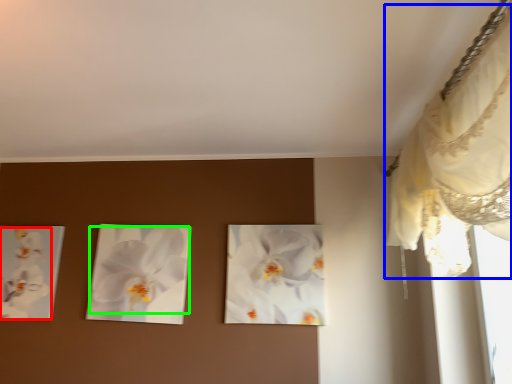
Question: Considering the real-world distances, which object is closest to flower (highlighted by a red box)? curtain (highlighted by a blue box) or flower (highlighted by a green box).

Choices:
 (A) curtain
 (B) flower

Answer: (B)